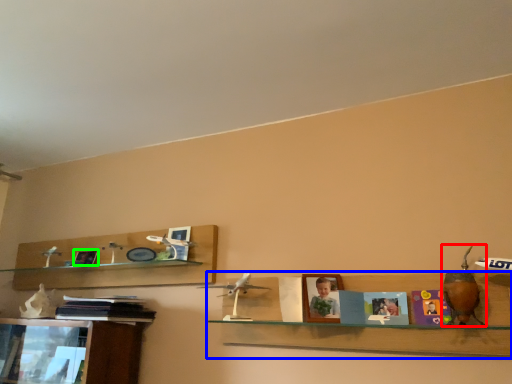
Question: Considering the real-world distances, which object is closest to toy (highlighted by a red box)? shelf (highlighted by a blue box) or picture frame (highlighted by a green box).

Choices:
 (A) shelf
 (B) picture frame

Answer: (A)